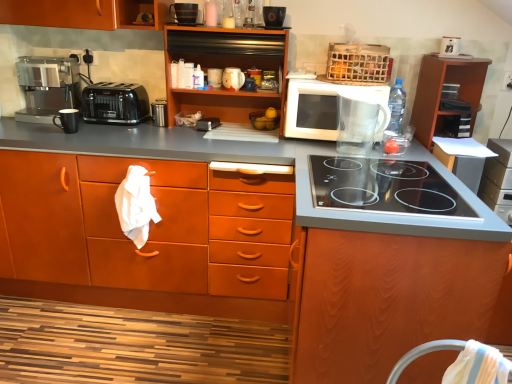
Question: From the image's perspective, is matte wood cabinets at center, the 2th cabinetry from the left, above or below white fabric chair at lower right?

Choices:
 (A) above
 (B) below

Answer: (A)

Question: Is matte wood cabinets at center, the 2th cabinetry from the left, wider or thinner than white fabric chair at lower right?

Choices:
 (A) wide
 (B) thin

Answer: (A)

Question: Estimate the real-world distances between objects in this image. Which object is closer to the wooden cabinet at center, which ranks as the 2th cabinetry in right-to-left order?

Choices:
 (A) matte wood cabinets at center, which is counted as the fourth cabinetry, starting from the right
 (B) transparent glass pitcher at center, the 1th appliance positioned from the bottom
 (C) white glossy microwave at upper center
 (D) wooden cabinet at upper center, the third cabinetry viewed from the left
 (E) black plastic toaster at left

Answer: (B)

Question: Estimate the real-world distances between objects in this image. Which object is farther from the matte wood cabinets at center, the 2th cabinetry from the left?

Choices:
 (A) white fabric at lower left
 (B) black plastic toaster at left
 (C) white glossy microwave at upper center
 (D) matte black toaster at upper left, the 1th appliance when ordered from top to bottom
 (E) wooden cabinet at center, which ranks as the 2th cabinetry in right-to-left order

Answer: (D)